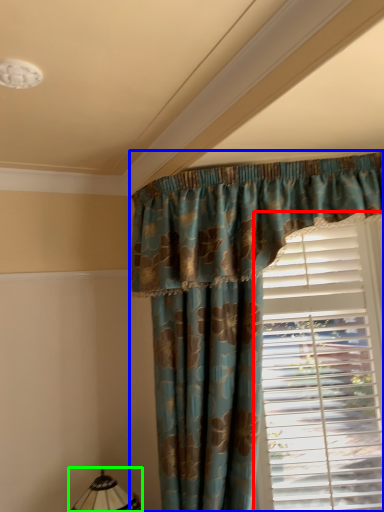
Question: Estimate the real-world distances between objects in this image. Which object is closer to window blind (highlighted by a red box), curtain (highlighted by a blue box) or table lamp (highlighted by a green box)?

Choices:
 (A) curtain
 (B) table lamp

Answer: (A)